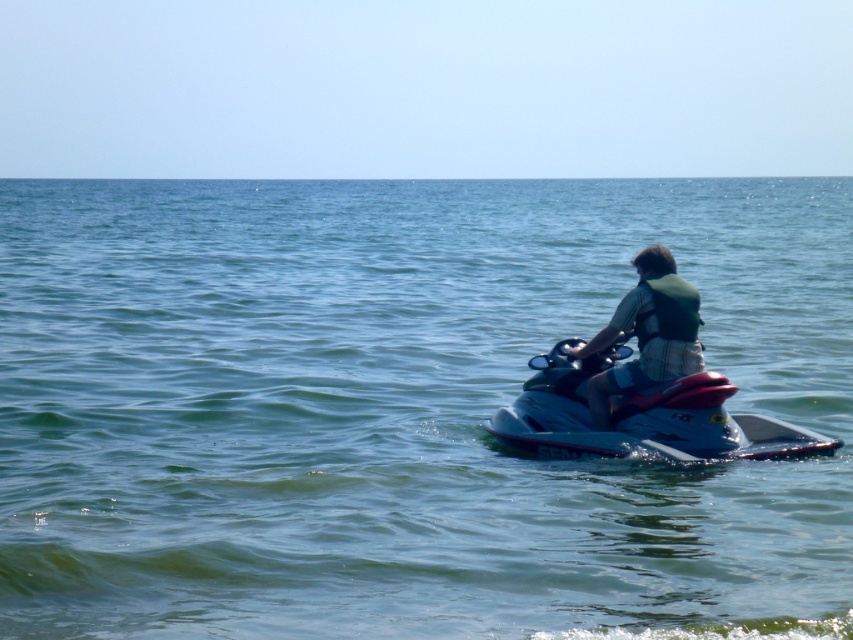
You are a safety inspector checking the equipment of a water sports rental company. You notice two items labeled as life vests at the center of the image. According to safety regulations, life vests must not be significantly taller than life jackets. Does the green fabric life vest at center comply with the regulation when compared to the green fabric life jacket at center?

The green fabric life vest at center is much taller than the green fabric life jacket at center. Since safety regulations state that life vests must not be significantly taller than life jackets, this indicates noncompliance with the regulation.

You are a safety inspector checking the jet ski rider. Based on the image, is the green fabric life jacket at center properly positioned under the rider in the clear blue water at center?

The clear blue water at center is located above the green fabric life jacket at center, which means the life jacket is indeed positioned underneath the rider in the water, so it is properly worn.